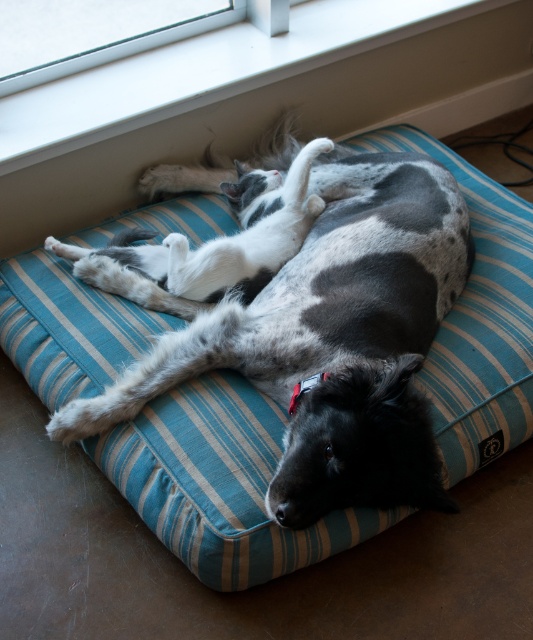
Who is more distant from viewer, (182, 369) or (156, 108)?

Positioned behind is point (156, 108).

Does spotted fur dog at center come behind white smooth window sill at upper center?

No, spotted fur dog at center is closer to the viewer.

Locate an element on the screen. The width and height of the screenshot is (533, 640). spotted fur dog at center is located at coordinates (333, 340).